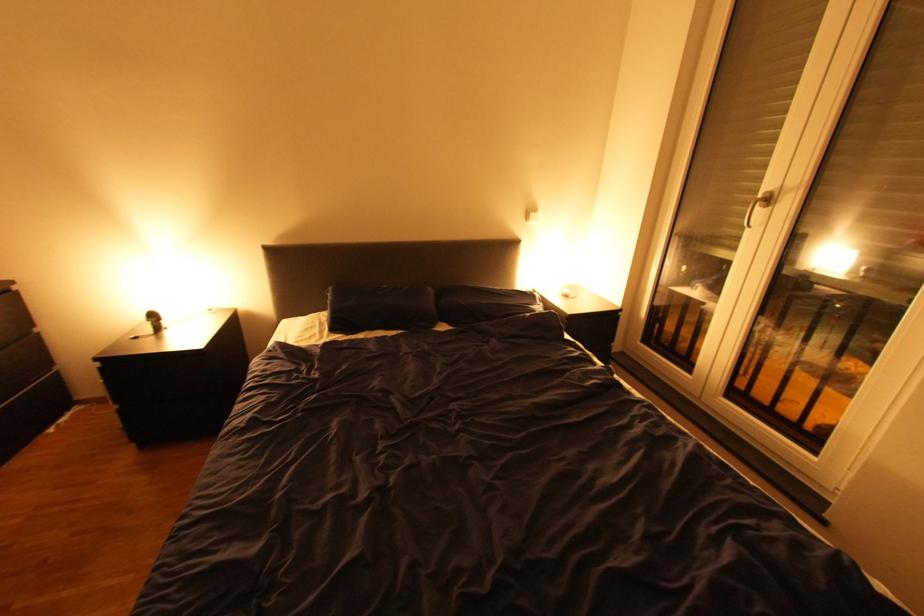
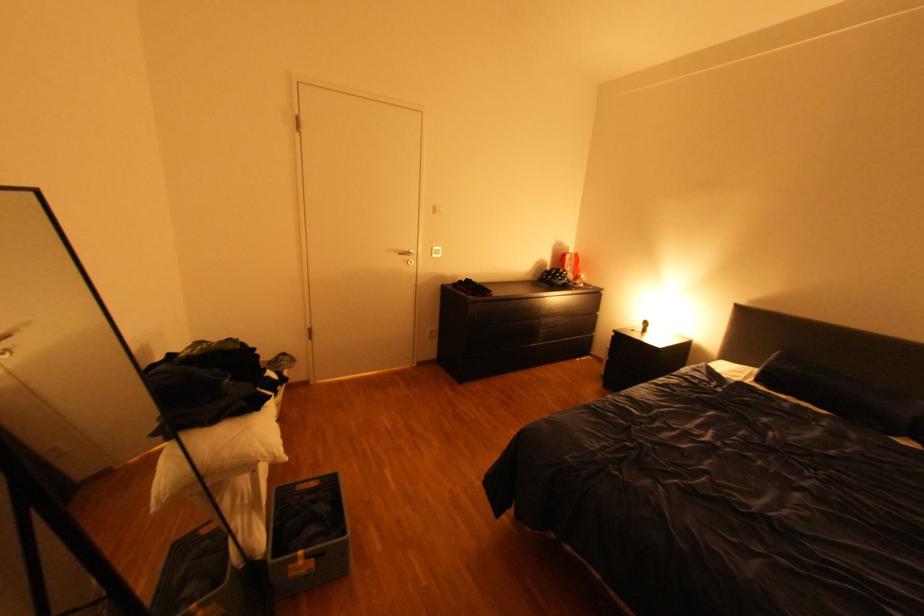
Question: The camera is either moving clockwise (left) or counter-clockwise (right) around the object. The first image is from the beginning of the video and the second image is from the end. Is the camera moving left or right when shooting the video?

Choices:
 (A) Left
 (B) Right

Answer: (B)